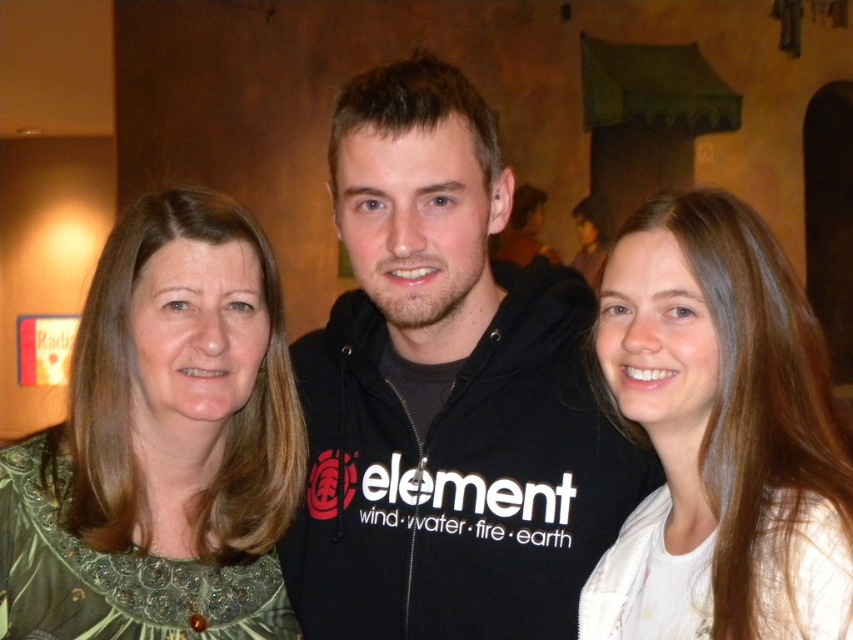
You are a photographer trying to adjust the camera angle to ensure both the black hoodie at center and the green sequined dress at left are fully visible in the frame. Considering their heights, which object should you focus on to avoid cropping either one?

The black hoodie at center is much taller as the green sequined dress at left, so you should focus on the black hoodie at center to ensure it is fully visible without cropping, as it is taller and might require adjusting the frame to accommodate its height.